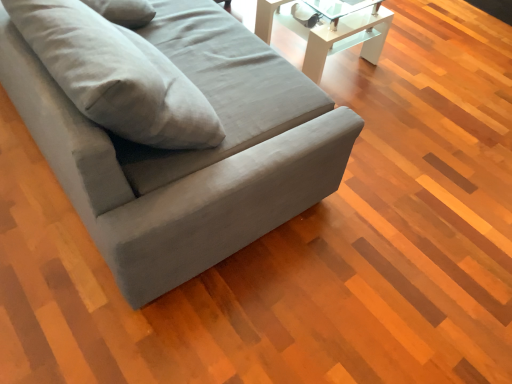
What do you see at coordinates (188, 151) in the screenshot? I see `matte gray couch at center` at bounding box center [188, 151].

This screenshot has height=384, width=512. Identify the location of matte gray couch at center. (188, 151).

The width and height of the screenshot is (512, 384). Identify the location of white glossy table at upper center. (330, 32).

What do you see at coordinates (330, 32) in the screenshot?
I see `white glossy table at upper center` at bounding box center [330, 32].

I want to click on matte gray couch at center, so click(188, 151).

Between white glossy table at upper center and matte gray couch at center, which one appears on the left side from the viewer's perspective?

matte gray couch at center is more to the left.

Looking at this image, considering their positions, is white glossy table at upper center located in front of or behind matte gray couch at center?

Visually, white glossy table at upper center is located behind matte gray couch at center.

Which is nearer, (x=268, y=3) or (x=172, y=159)?

Point (x=268, y=3) is positioned farther from the camera compared to point (x=172, y=159).

From the image's perspective, between white glossy table at upper center and matte gray couch at center, which one is located above?

white glossy table at upper center.

From a real-world perspective, is white glossy table at upper center positioned under matte gray couch at center based on gravity?

Yes, from a real-world perspective, white glossy table at upper center is beneath matte gray couch at center.

Consider the image. Does white glossy table at upper center have a lesser width compared to matte gray couch at center?

Indeed, white glossy table at upper center has a lesser width compared to matte gray couch at center.

Is white glossy table at upper center taller than matte gray couch at center?

No.

Looking at the image, does white glossy table at upper center seem bigger or smaller compared to matte gray couch at center?

In the image, white glossy table at upper center appears to be smaller than matte gray couch at center.

Is white glossy table at upper center not inside matte gray couch at center?

white glossy table at upper center is positioned outside matte gray couch at center.

Is white glossy table at upper center with matte gray couch at center?

No, white glossy table at upper center is not making contact with matte gray couch at center.

Is white glossy table at upper center turned away from matte gray couch at center?

That's right, white glossy table at upper center is facing away from matte gray couch at center.

From the picture: Can you tell me how much white glossy table at upper center and matte gray couch at center differ in facing direction?

9.69e-05 degrees separate the facing orientations of white glossy table at upper center and matte gray couch at center.

In the image, there is a matte gray couch at center. Identify the location of table below it (from a real-world perspective). The image size is (512, 384). click(330, 32).

Does matte gray couch at center appear on the left side of white glossy table at upper center?

Correct, you'll find matte gray couch at center to the left of white glossy table at upper center.

Relative to white glossy table at upper center, is matte gray couch at center in front or behind?

In the image, matte gray couch at center appears in front of white glossy table at upper center.

Is point (76, 145) closer to viewer compared to point (372, 45)?

Yes.

Consider the image. From the image's perspective, is matte gray couch at center on white glossy table at upper center?

No, from the image's perspective, matte gray couch at center is not over white glossy table at upper center.

Based on the photo, from a real-world perspective, is matte gray couch at center located beneath white glossy table at upper center?

No, from a real-world perspective, matte gray couch at center is not beneath white glossy table at upper center.

In terms of width, does matte gray couch at center look wider or thinner when compared to white glossy table at upper center?

matte gray couch at center is wider than white glossy table at upper center.

Can you confirm if matte gray couch at center is taller than white glossy table at upper center?

Indeed, matte gray couch at center has a greater height compared to white glossy table at upper center.

Looking at the image, does matte gray couch at center seem bigger or smaller compared to white glossy table at upper center?

In the image, matte gray couch at center appears to be larger than white glossy table at upper center.

Choose the correct answer: Is matte gray couch at center inside white glossy table at upper center or outside it?

matte gray couch at center exists outside the volume of white glossy table at upper center.

Are matte gray couch at center and white glossy table at upper center beside each other?

They are not placed beside each other.

Is matte gray couch at center positioned with its back to white glossy table at upper center?

A: That's not correct — matte gray couch at center is not looking away from white glossy table at upper center.

Where is `table on the right of matte gray couch at center`? The height and width of the screenshot is (384, 512). table on the right of matte gray couch at center is located at coordinates (330, 32).

This screenshot has height=384, width=512. What are the coordinates of `table on the right of matte gray couch at center` in the screenshot? It's located at (330, 32).

The width and height of the screenshot is (512, 384). What are the coordinates of `studio couch located on the left of white glossy table at upper center` in the screenshot? It's located at (188, 151).